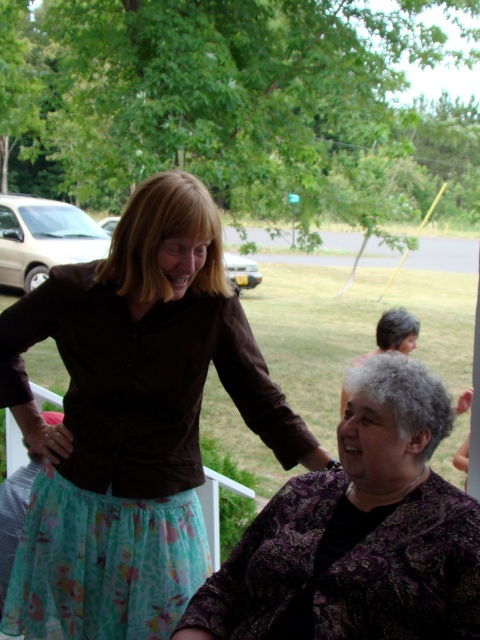
Question: Can you confirm if purple paisley blouse at lower right is positioned above gray curly hair at lower center?

Choices:
 (A) no
 (B) yes

Answer: (A)

Question: Which of the following is the closest to the observer?

Choices:
 (A) gray curly hair at lower center
 (B) floral chiffon skirt at upper left

Answer: (B)

Question: Considering the real-world distances, which object is closest to the purple paisley blouse at lower right?

Choices:
 (A) gray curly hair at lower center
 (B) floral chiffon skirt at upper left

Answer: (B)

Question: Can you confirm if floral chiffon skirt at upper left is positioned to the left of purple paisley blouse at lower right?

Choices:
 (A) no
 (B) yes

Answer: (B)

Question: Which object is closer to the camera taking this photo?

Choices:
 (A) gray curly hair at lower center
 (B) purple paisley blouse at lower right

Answer: (B)

Question: Does floral chiffon skirt at upper left have a lesser width compared to gray curly hair at lower center?

Choices:
 (A) no
 (B) yes

Answer: (A)